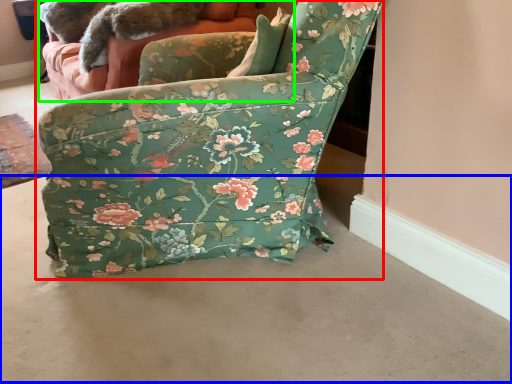
Question: Based on their relative distances, which object is farther from chair (highlighted by a red box)? Choose from concrete (highlighted by a blue box) and couch (highlighted by a green box).

Choices:
 (A) concrete
 (B) couch

Answer: (B)